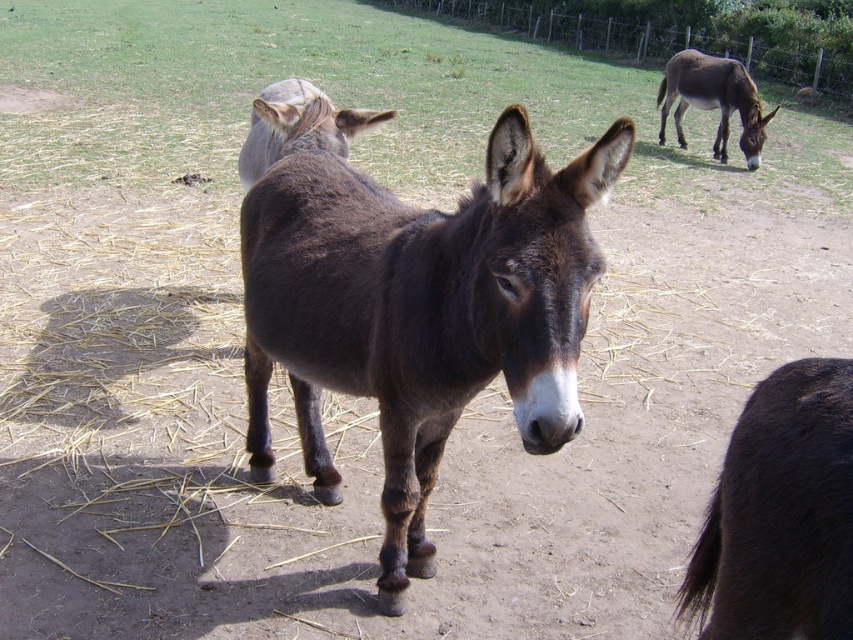
Question: Which of the following is the farthest from the observer?

Choices:
 (A) brown matte donkey at upper center
 (B) dark brown fur at center

Answer: (A)

Question: Can you confirm if dark brown fur at center is bigger than brown matte donkey at upper center?

Choices:
 (A) yes
 (B) no

Answer: (A)

Question: Which object is the closest to the brown matte mule at upper right?

Choices:
 (A) dark brown fur at center
 (B) brown matte donkey at upper center
 (C) dark brown fur at lower right

Answer: (B)

Question: Which point is closer to the camera?

Choices:
 (A) (738, 589)
 (B) (421, 476)
 (C) (335, 134)
 (D) (695, 83)

Answer: (A)

Question: Can you confirm if dark brown fur at center is positioned below brown matte mule at upper right?

Choices:
 (A) no
 (B) yes

Answer: (B)

Question: Can you confirm if brown matte donkey at upper center is positioned below brown matte mule at upper right?

Choices:
 (A) no
 (B) yes

Answer: (B)